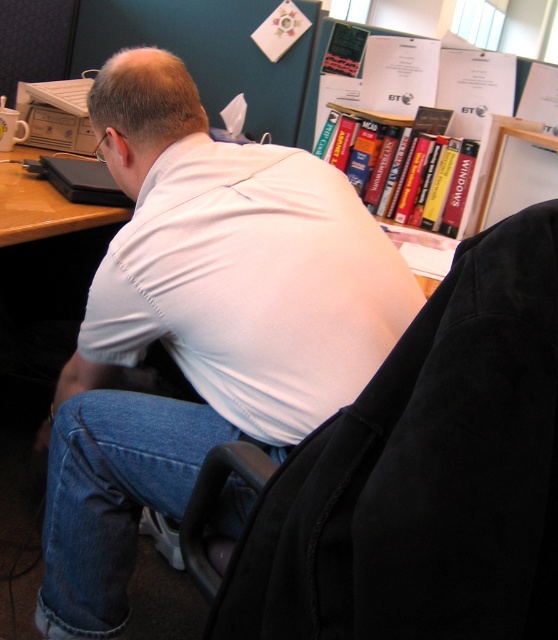
You are an office worker who needs to adjust the height of your monitor to match your posture. You see the white matte shirt at upper center and the black fabric swivel chair at center. Which object is taller, and should you raise or lower your monitor?

The white matte shirt at upper center is taller than the black fabric swivel chair at center. Since the shirt is part of the person, you should adjust the monitor height to align with the user posture, likely raising it to meet eye level.

You are an office worker who needs to locate the white matte shirt at upper center in the office scene. Based on its coordinates, where would you find it?

The white matte shirt at upper center is located at coordinates point (201, 324).

You are an office worker who needs to sit down. You see the white matte shirt at upper center and the black fabric swivel chair at center. Which object should you avoid sitting on?

You should avoid sitting on the white matte shirt at upper center because it is positioned over the black fabric swivel chair at center, meaning the shirt is likely worn by the man sitting on the chair. The chair is the appropriate seating option.